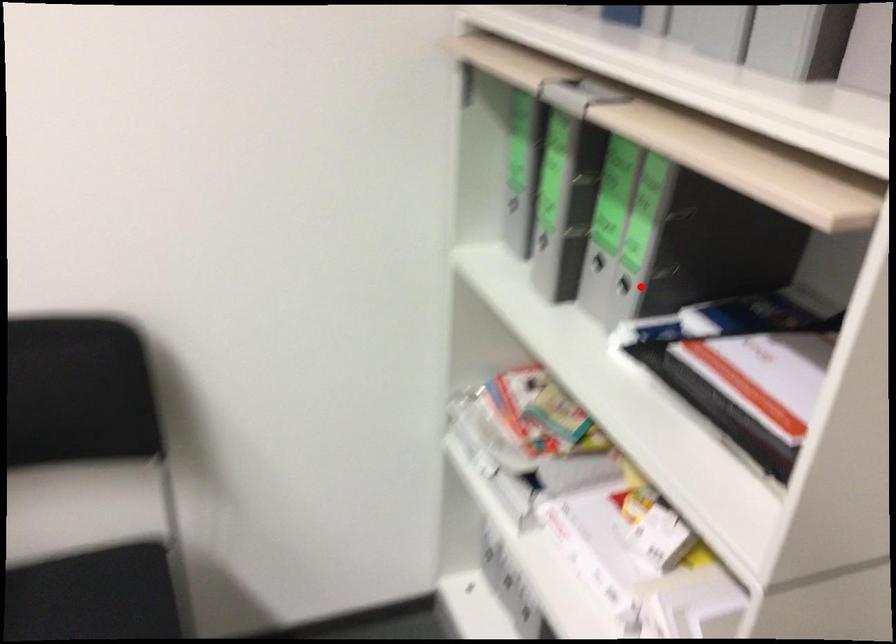
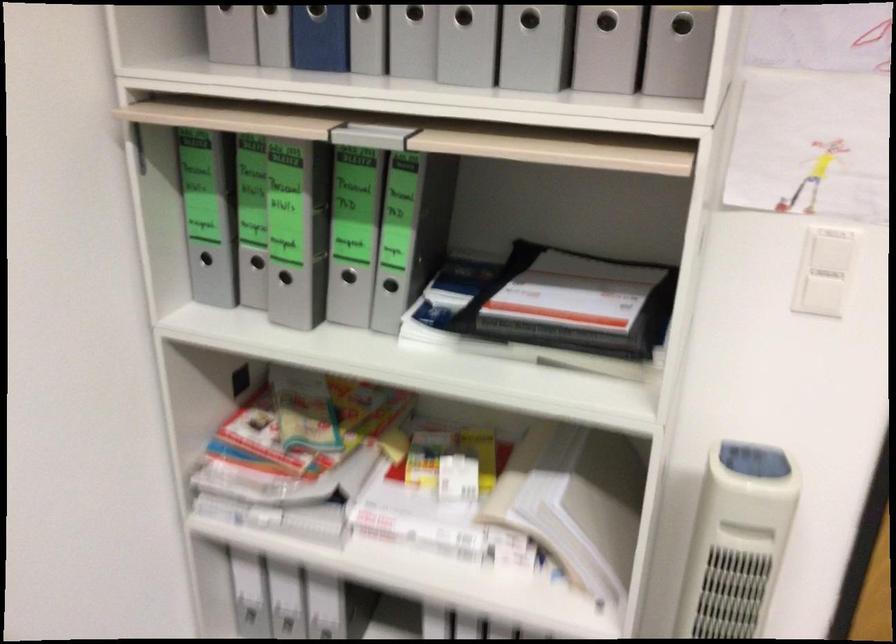
Question: I am providing you with two images of the same scene from different viewpoints. In image1, a red point is highlighted. Considering the same 3D point in image2, which of the following is correct?

Choices:
 (A) It is closer
 (B) It is farther

Answer: (B)